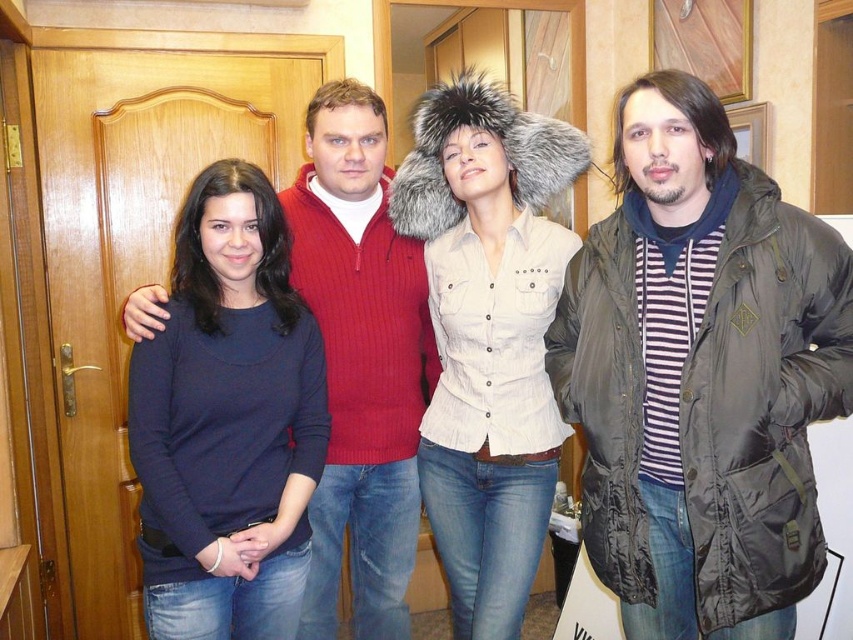
In the scene shown: Between dark olive-green puffer jacket at right and dark blue sweater at center, which one is positioned higher?

dark olive-green puffer jacket at right is above.

Is point (792, 371) positioned in front of point (144, 452)?

Yes.

The width and height of the screenshot is (853, 640). Find the location of `dark olive-green puffer jacket at right`. dark olive-green puffer jacket at right is located at coordinates (700, 376).

Looking at this image, which is more to the right, dark blue sweater at center or white cotton shirt at center?

Positioned to the right is white cotton shirt at center.

Is dark blue sweater at center to the right of white cotton shirt at center from the viewer's perspective?

No, dark blue sweater at center is not to the right of white cotton shirt at center.

Does point (160, 465) come in front of point (508, 237)?

Yes, it is in front of point (508, 237).

Locate an element on the screen. The height and width of the screenshot is (640, 853). dark blue sweater at center is located at coordinates (227, 420).

Is dark olive-green puffer jacket at right taller than white cotton shirt at center?

No.

Does dark olive-green puffer jacket at right appear over white cotton shirt at center?

Indeed, dark olive-green puffer jacket at right is positioned over white cotton shirt at center.

Where is `dark olive-green puffer jacket at right`? This screenshot has height=640, width=853. dark olive-green puffer jacket at right is located at coordinates (700, 376).